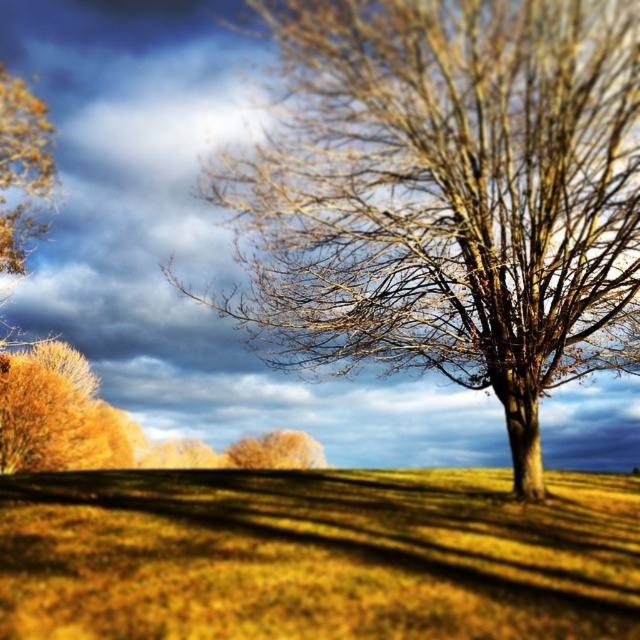
Measure the distance between bare wood tree at center and camera.

bare wood tree at center and camera are 44.88 feet apart.

Does bare wood tree at center have a lesser height compared to yellow grassy field at center?

No, bare wood tree at center is not shorter than yellow grassy field at center.

Measure the distance between bare wood tree at center and camera.

A distance of 13.68 meters exists between bare wood tree at center and camera.

You are a GUI agent. You are given a task and a screenshot of the screen. Output one action in this format:
    pyautogui.click(x=<x>, y=<y>)
    Task: Click on the bare wood tree at center
    This screenshot has width=640, height=640.
    Given the screenshot: What is the action you would take?
    pyautogui.click(x=445, y=196)

Can you confirm if yellow grassy field at center is taller than golden textured tree at center?

In fact, yellow grassy field at center may be shorter than golden textured tree at center.

Which is above, yellow grassy field at center or golden textured tree at center?

Positioned higher is yellow grassy field at center.

This screenshot has width=640, height=640. What are the coordinates of `yellow grassy field at center` in the screenshot? It's located at (316, 554).

Locate an element on the screen. yellow grassy field at center is located at coordinates (316, 554).

Between bare wood tree at center and golden textured tree at center, which one is positioned higher?

Positioned higher is bare wood tree at center.

Between bare wood tree at center and golden textured tree at center, which one has more height?

golden textured tree at center

Which is behind, point (317, 36) or point (288, 458)?

Point (288, 458)

At what (x,y) coordinates should I click in order to perform the action: click on bare wood tree at center. Please return your answer as a coordinate pair (x, y). The height and width of the screenshot is (640, 640). Looking at the image, I should click on (445, 196).